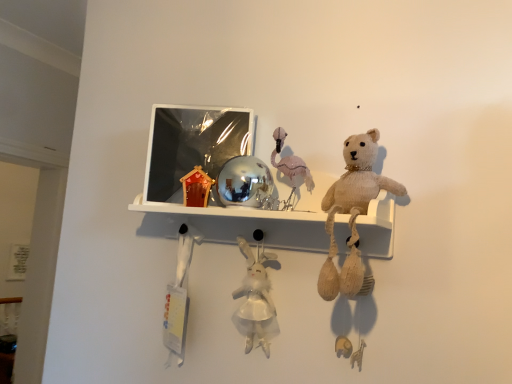
Question: Considering the relative sizes of white fabric toy at lower left, which is the 1th toy in left-to-right order, and white plush rabbit at center, marked as the second toy in a right-to-left arrangement, in the image provided, is white fabric toy at lower left, which is the 1th toy in left-to-right order, shorter than white plush rabbit at center, marked as the second toy in a right-to-left arrangement,?

Choices:
 (A) no
 (B) yes

Answer: (A)

Question: Is white plush rabbit at center, which is the second toy in left-to-right order, surrounded by white fabric toy at lower left, which is the 1th toy in left-to-right order?

Choices:
 (A) yes
 (B) no

Answer: (B)

Question: Is white fabric toy at lower left, the third toy in the right-to-left sequence, looking in the opposite direction of white plush rabbit at center, marked as the second toy in a right-to-left arrangement?

Choices:
 (A) no
 (B) yes

Answer: (A)

Question: Is the position of white fabric toy at lower left, the third toy in the right-to-left sequence, more distant than that of white plush rabbit at center, which is the second toy in left-to-right order?

Choices:
 (A) yes
 (B) no

Answer: (A)

Question: From a real-world perspective, is white fabric toy at lower left, which is the 1th toy in left-to-right order, physically below white plush rabbit at center, which is the second toy in left-to-right order?

Choices:
 (A) no
 (B) yes

Answer: (B)

Question: Is metallic reflective picture frame at upper center in front of or behind white plush rabbit at center, marked as the second toy in a right-to-left arrangement, in the image?

Choices:
 (A) behind
 (B) front

Answer: (A)

Question: Does point (155, 129) appear closer or farther from the camera than point (252, 279)?

Choices:
 (A) farther
 (B) closer

Answer: (A)

Question: From the image's perspective, relative to white plush rabbit at center, which is the second toy in left-to-right order, is metallic reflective picture frame at upper center above or below?

Choices:
 (A) below
 (B) above

Answer: (B)

Question: Visually, is metallic reflective picture frame at upper center positioned to the left or to the right of white plush rabbit at center, which is the second toy in left-to-right order?

Choices:
 (A) left
 (B) right

Answer: (A)

Question: Considering the positions of knitted beige teddy bear at upper right and shiny metallic ball at center in the image, is knitted beige teddy bear at upper right wider or thinner than shiny metallic ball at center?

Choices:
 (A) thin
 (B) wide

Answer: (A)

Question: Looking at the image, does knitted beige teddy bear at upper right seem bigger or smaller compared to shiny metallic ball at center?

Choices:
 (A) big
 (B) small

Answer: (A)

Question: Is point (350, 289) positioned closer to the camera than point (258, 225)?

Choices:
 (A) farther
 (B) closer

Answer: (B)

Question: In the image, is knitted beige teddy bear at upper right positioned in front of or behind shiny metallic ball at center?

Choices:
 (A) behind
 (B) front

Answer: (B)

Question: Is shiny metallic ball at center wider or thinner than white plush rabbit at center, marked as the second toy in a right-to-left arrangement?

Choices:
 (A) wide
 (B) thin

Answer: (A)

Question: From the image's perspective, is shiny metallic ball at center positioned above or below white plush rabbit at center, which is the second toy in left-to-right order?

Choices:
 (A) below
 (B) above

Answer: (B)